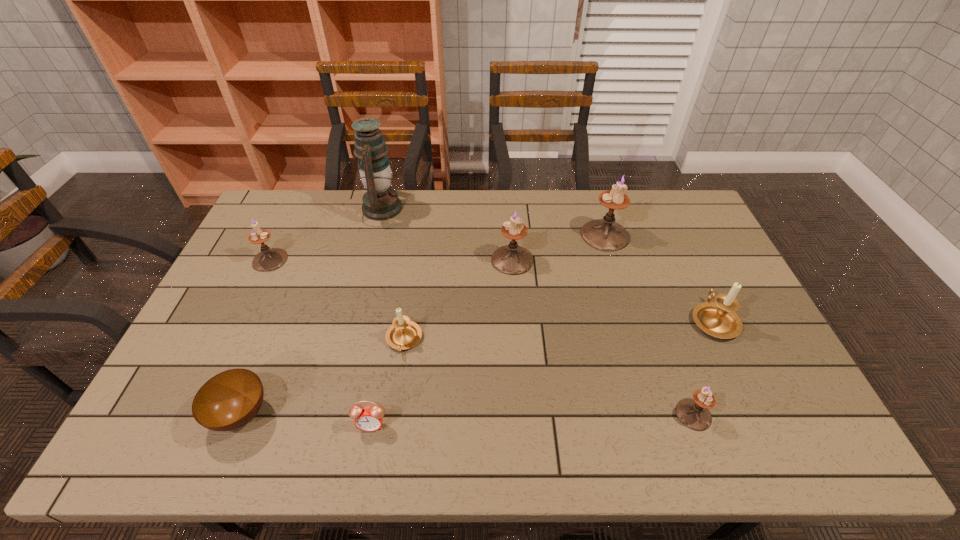
Where is `oil lamp`? The width and height of the screenshot is (960, 540). oil lamp is located at coordinates (380, 202).

Identify the location of the tallest object. (380, 202).

Image resolution: width=960 pixels, height=540 pixels. I want to click on the tallest candle holder, so click(605, 234).

The height and width of the screenshot is (540, 960). Find the location of `the biggest purple candle holder`. the biggest purple candle holder is located at coordinates (605, 234).

I want to click on the third tallest object, so click(x=512, y=259).

Find the location of a particular element. The image size is (960, 540). the second tallest candle holder is located at coordinates (512, 259).

Identify the location of the second smallest purple candle holder. (269, 259).

Locate an element on the screen. the leftmost candle holder is located at coordinates (269, 259).

Find the location of `the bigger beige candle holder`. the bigger beige candle holder is located at coordinates (719, 319).

The height and width of the screenshot is (540, 960). Identify the location of the right beige candle holder. (719, 319).